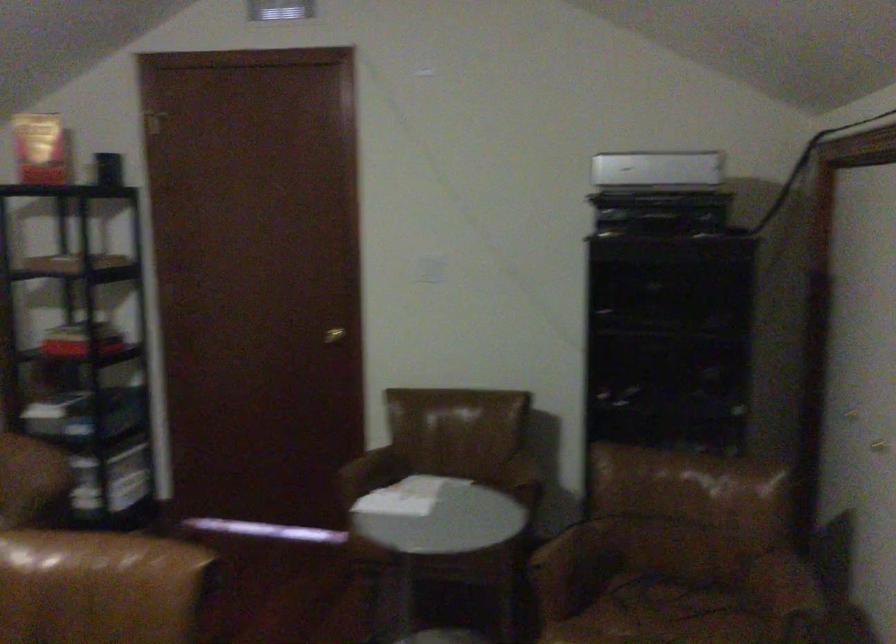
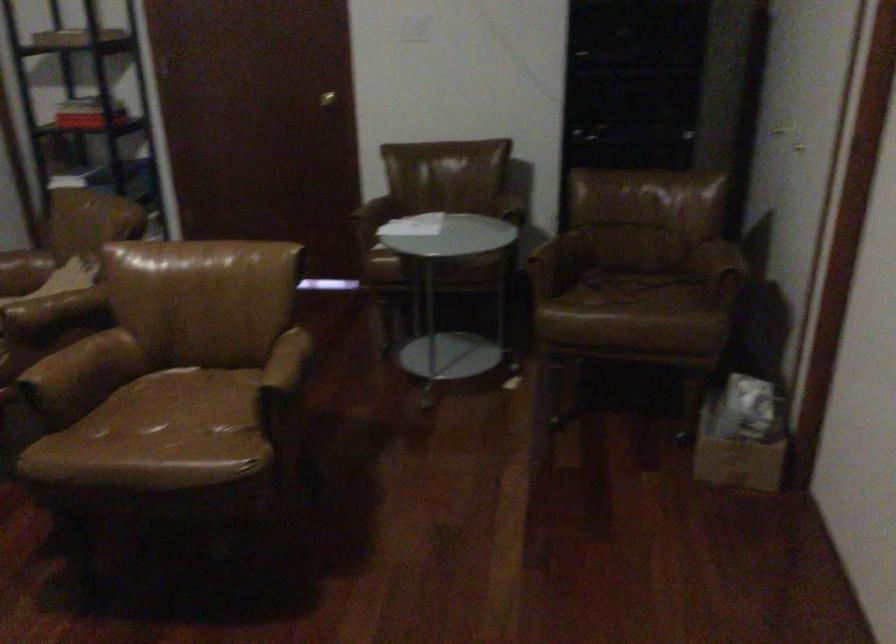
Locate, in the second image, the point that corresponds to pixel 338 341 in the first image.

(326, 99)